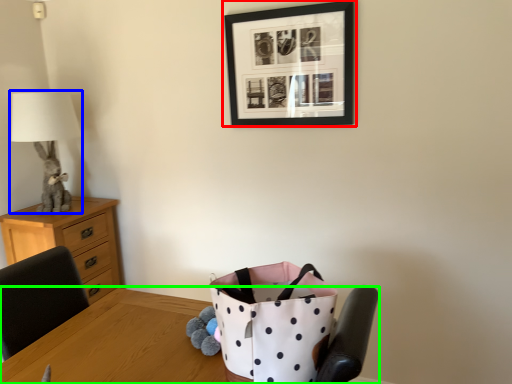
Question: Based on their relative distances, which object is farther from picture frame (highlighted by a red box)? Choose from table lamp (highlighted by a blue box) and table (highlighted by a green box).

Choices:
 (A) table lamp
 (B) table

Answer: (B)